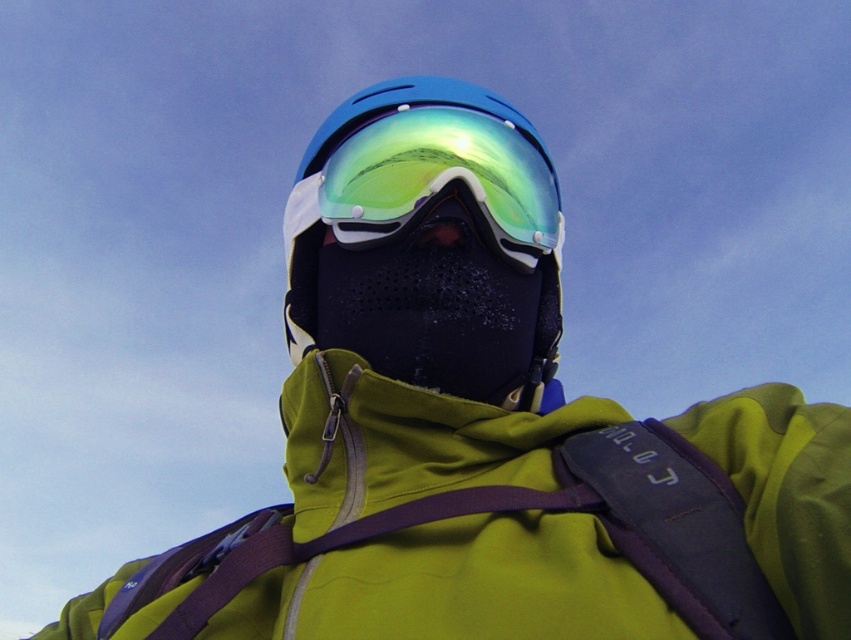
Is point (333, 131) behind point (395, 202)?

Yes, it is.

Looking at this image, who is more distant from viewer, (527, 264) or (418, 150)?

Point (527, 264)

Does point (507, 177) come closer to viewer compared to point (380, 157)?

No, (507, 177) is behind (380, 157).

Image resolution: width=851 pixels, height=640 pixels. I want to click on blue matte helmet at center, so click(x=427, y=195).